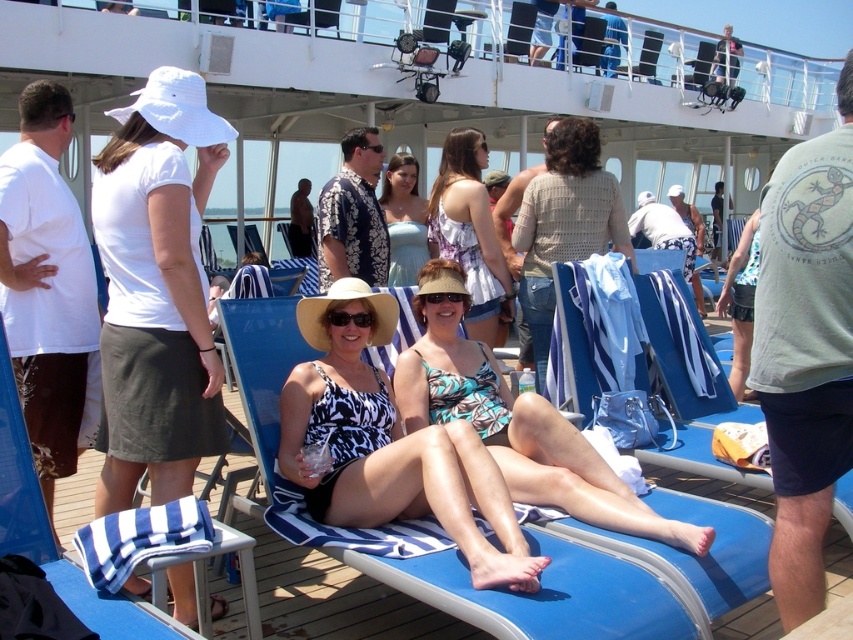
You are a photographer on the cruise ship deck. You want to take a photo of the light blue satin dress at center and the white cotton hat at upper left. Based on their positions, which object should you focus on first to ensure both are in the frame?

The white cotton hat at upper left is below the light blue satin dress at center, so you should focus on the light blue satin dress at center first to ensure both are in the frame.

From the picture: You are a photographer on the cruise ship deck. You need to capture a photo of both the printed fabric bikini at center and the light blue satin dress at center. Which one should you focus on first if you want to include both in your frame without moving the camera?

The printed fabric bikini at center is located below the light blue satin dress at center, so you should focus on the light blue satin dress at center first to ensure both are in the frame.

You are standing on the cruise ship deck and want to take a photo of the point at coordinates [169,390]. The camera you are using has a maximum focus range of 10 feet. Will the camera be able to focus on the point?

The point at coordinates [169,390] is 9.95 feet away from the camera, which is within the maximum focus range of 10 feet. Therefore, the camera should be able to focus on the point.